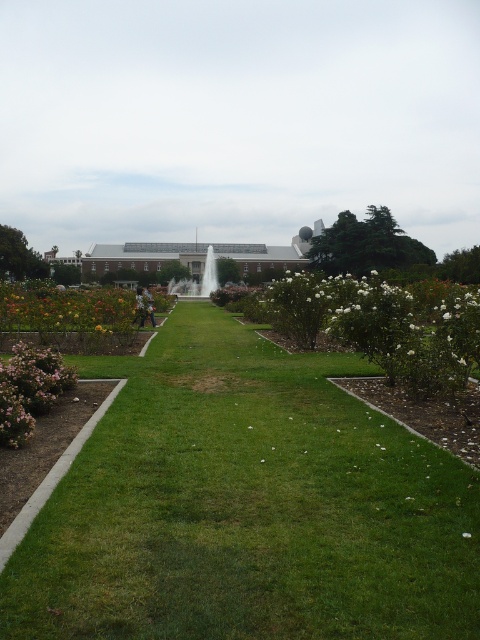
Is point (455, 376) closer to viewer compared to point (199, 268)?

That is True.

Between white matte bush at center-right and white marble fountain at center, which one has less height?

With less height is white matte bush at center-right.

Measure the distance between point [322,296] and camera.

The distance of point [322,296] from camera is 14.37 meters.

Locate an element on the screen. Image resolution: width=480 pixels, height=640 pixels. white matte bush at center-right is located at coordinates (384, 324).

Which of these two, green grass at center or white matte bush at center-right, stands shorter?

green grass at center is shorter.

Between point (441, 612) and point (363, 324), which one is positioned behind?

The point (363, 324) is more distant.

Which is behind, point (309, 486) or point (455, 317)?

The point (455, 317) is behind.

This screenshot has height=640, width=480. Identify the location of green grass at center. (245, 506).

Does green grass at center have a greater height compared to pink matte bush at lower left?

In fact, green grass at center may be shorter than pink matte bush at lower left.

Who is more forward, (195, 464) or (38, 360)?

Positioned in front is point (195, 464).

Identify the location of green grass at center. This screenshot has width=480, height=640. (245, 506).